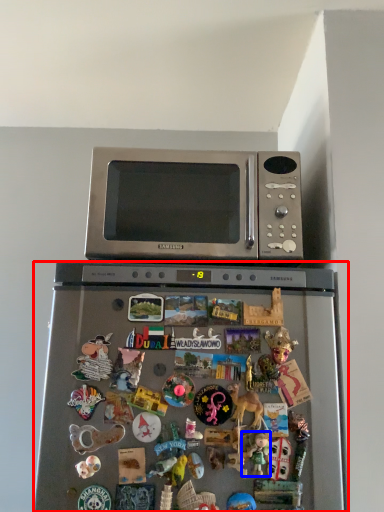
Question: Which object appears closest to the camera in this image, refrigerator (highlighted by a red box) or toy (highlighted by a blue box)?

Choices:
 (A) refrigerator
 (B) toy

Answer: (A)